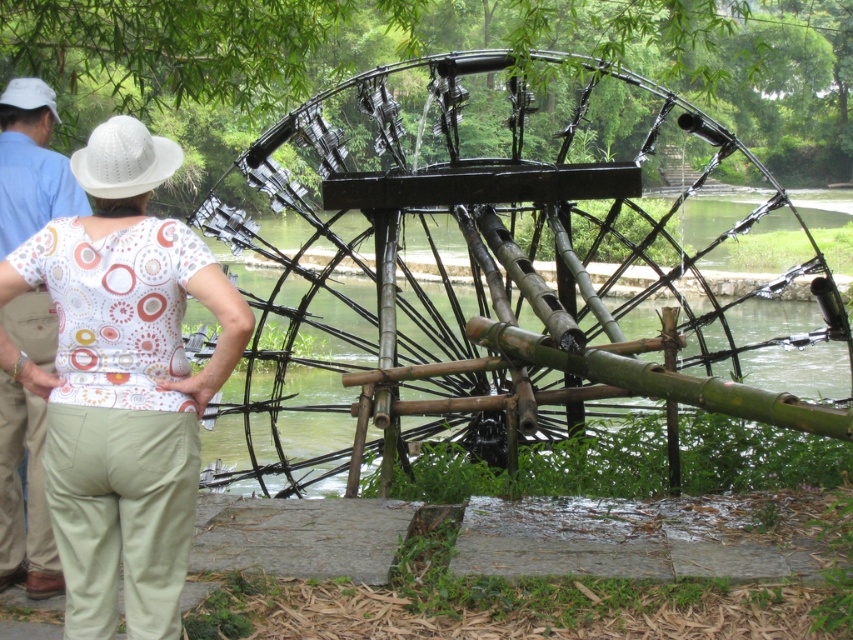
Who is shorter, white printed blouse at upper left or blue cotton shirt at upper left?

With less height is blue cotton shirt at upper left.

In the scene shown: Between white printed blouse at upper left and blue cotton shirt at upper left, which one appears on the left side from the viewer's perspective?

Positioned to the left is blue cotton shirt at upper left.

Is point (105, 593) closer to viewer compared to point (44, 508)?

Yes, it is in front of point (44, 508).

Where is `white printed blouse at upper left`? white printed blouse at upper left is located at coordinates (122, 381).

Between point (640, 77) and point (144, 308), which one is positioned in front?

Point (144, 308) is more forward.

Looking at this image, can you confirm if black bamboo waterwheel at center is positioned above white printed blouse at upper left?

Yes, black bamboo waterwheel at center is above white printed blouse at upper left.

Between point (680, 273) and point (93, 620), which one is positioned behind?

Positioned behind is point (680, 273).

You are a GUI agent. You are given a task and a screenshot of the screen. Output one action in this format:
    pyautogui.click(x=<x>, y=<y>)
    Task: Click on the black bamboo waterwheel at center
    
    Given the screenshot: What is the action you would take?
    pyautogui.click(x=480, y=253)

Measure the distance between black bamboo waterwheel at center and blue cotton shirt at upper left.

A distance of 24.64 meters exists between black bamboo waterwheel at center and blue cotton shirt at upper left.

Looking at this image, between black bamboo waterwheel at center and blue cotton shirt at upper left, which one appears on the left side from the viewer's perspective?

From the viewer's perspective, blue cotton shirt at upper left appears more on the left side.

What do you see at coordinates (480, 253) in the screenshot? I see `black bamboo waterwheel at center` at bounding box center [480, 253].

Find the location of a particular element. black bamboo waterwheel at center is located at coordinates (480, 253).